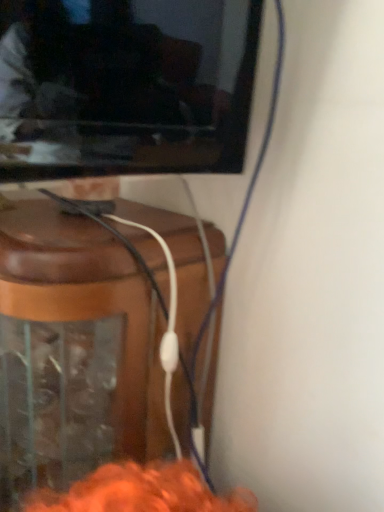
Locate an element on the screen. This screenshot has height=512, width=384. free location above brown wood speaker at lower left (from a real-world perspective) is located at coordinates (69, 217).